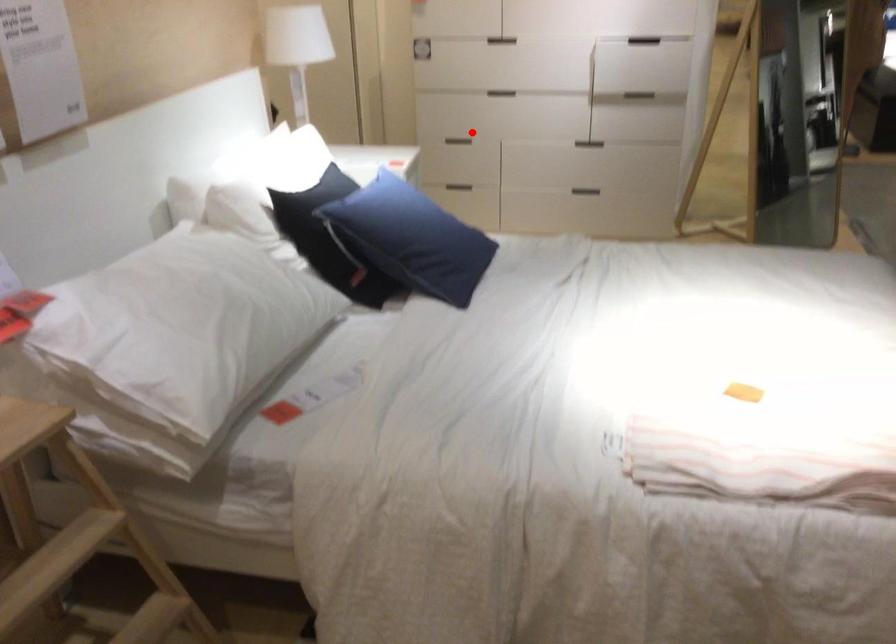
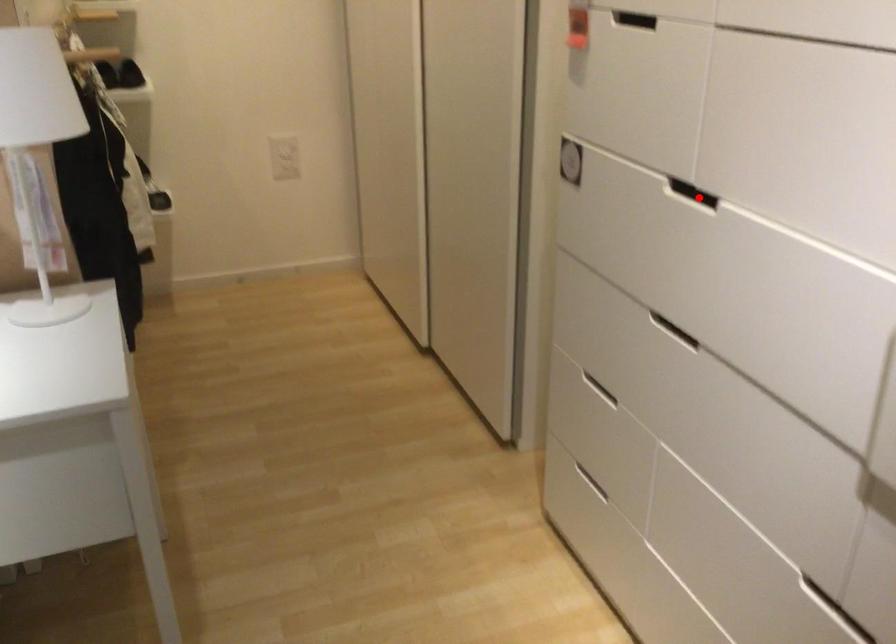
In the scene shown: I am providing you with two images of the same scene from different viewpoints. A red point is marked on the first image and another point is marked on the second image. Is the marked point in image1 the same physical position as the marked point in image2?

No